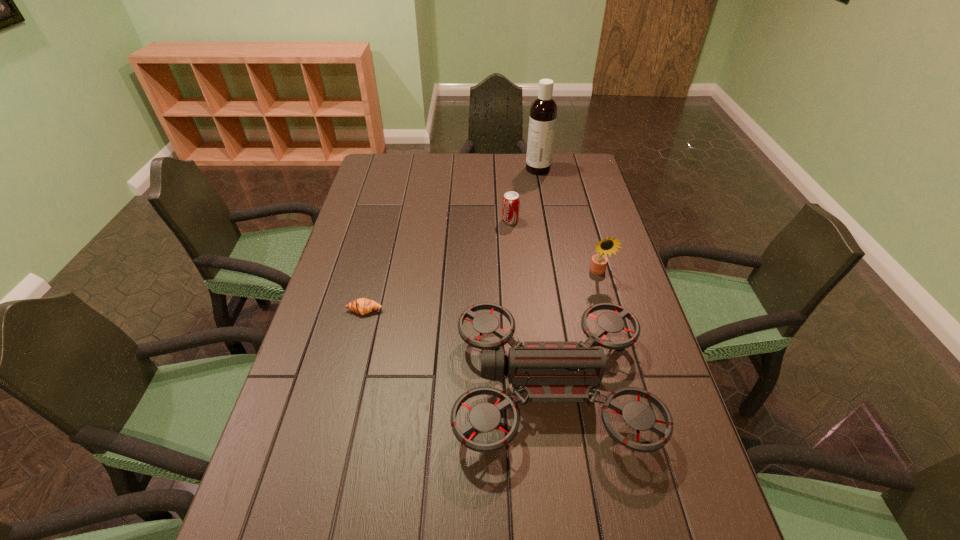
The height and width of the screenshot is (540, 960). Identify the location of free space located on the label side of the dishwasher detergent. coord(504,169).

Where is `vacant position located on the label side of the dishwasher detergent`? This screenshot has width=960, height=540. vacant position located on the label side of the dishwasher detergent is located at coordinates (455, 169).

Where is `vacant space located on the label side of the dishwasher detergent`? vacant space located on the label side of the dishwasher detergent is located at coordinates (465, 169).

What are the coordinates of `vacant position located on the face of the fourth shortest object` in the screenshot? It's located at (619, 349).

Where is `vacant space located on the front-facing side of the third tallest object`? Image resolution: width=960 pixels, height=540 pixels. vacant space located on the front-facing side of the third tallest object is located at coordinates (327, 386).

The width and height of the screenshot is (960, 540). I want to click on vacant area situated on the front-facing side of the third tallest object, so 430,386.

Where is `vacant space situated on the front-facing side of the third tallest object`? This screenshot has height=540, width=960. vacant space situated on the front-facing side of the third tallest object is located at coordinates coord(421,386).

Locate an element on the screen. The height and width of the screenshot is (540, 960). vacant space located 0.090m on the front of the soda can is located at coordinates (512, 242).

The height and width of the screenshot is (540, 960). I want to click on vacant space situated on the front-facing side of the shortest object, so click(x=355, y=349).

The image size is (960, 540). I want to click on object located at the far edge, so click(x=543, y=112).